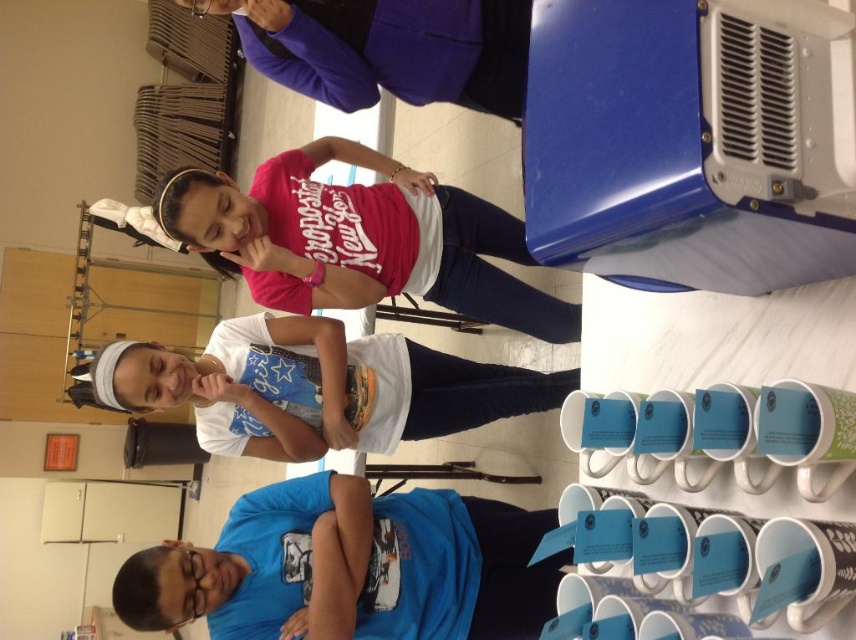
Question: Which point is closer to the camera?

Choices:
 (A) matte pink shirt at upper center
 (B) clear plastic goggles at lower left
 (C) white matte t-shirt at center

Answer: (B)

Question: Does matte pink shirt at upper center appear on the left side of white matte t-shirt at center?

Choices:
 (A) no
 (B) yes

Answer: (A)

Question: Among these objects, which one is nearest to the camera?

Choices:
 (A) matte pink shirt at upper center
 (B) white matte t-shirt at center

Answer: (A)

Question: Can you confirm if matte pink shirt at upper center is bigger than white matte t-shirt at center?

Choices:
 (A) yes
 (B) no

Answer: (B)

Question: Which point is closer to the camera?

Choices:
 (A) (438, 212)
 (B) (314, 385)

Answer: (B)

Question: Can you confirm if white matte t-shirt at center is positioned to the left of clear plastic goggles at lower left?

Choices:
 (A) yes
 (B) no

Answer: (B)